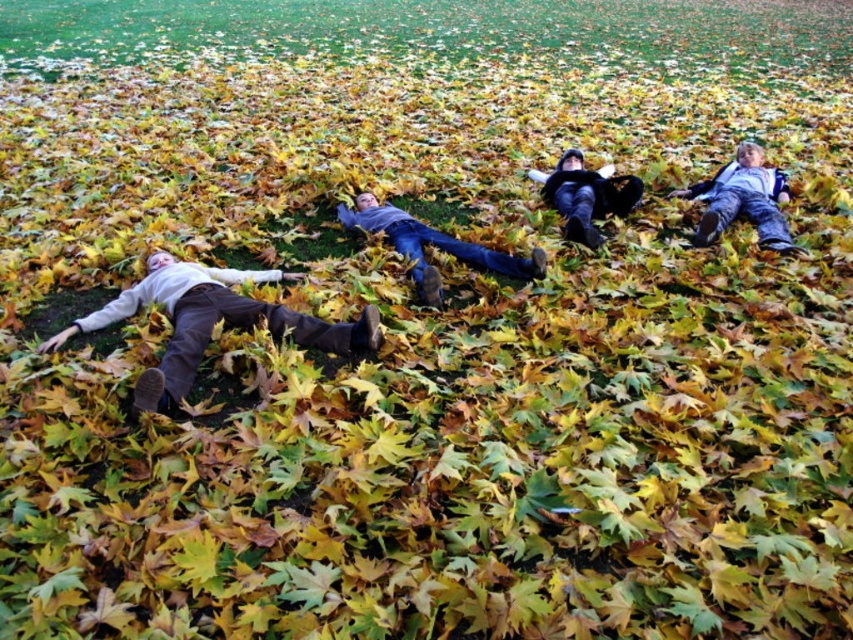
Does matte gray sweater at left appear on the left side of dark gray sweater at center?

Indeed, matte gray sweater at left is positioned on the left side of dark gray sweater at center.

Can you confirm if matte gray sweater at left is thinner than dark gray sweater at center?

No, matte gray sweater at left is not thinner than dark gray sweater at center.

Which is behind, point (161, 296) or point (625, 202)?

The point (625, 202) is more distant.

Identify the location of matte gray sweater at left. Image resolution: width=853 pixels, height=640 pixels. (212, 323).

Measure the distance from gray sweater at center to dark gray sweater at center.

gray sweater at center is 1.23 meters away from dark gray sweater at center.

Who is shorter, gray sweater at center or dark gray sweater at center?

gray sweater at center

Which is behind, point (473, 250) or point (635, 186)?

Point (635, 186)

You are a GUI agent. You are given a task and a screenshot of the screen. Output one action in this format:
    pyautogui.click(x=<x>, y=<y>)
    Task: Click on the gray sweater at center
    The width and height of the screenshot is (853, 640).
    Given the screenshot: What is the action you would take?
    tap(433, 244)

Find the location of a particular element. This screenshot has height=640, width=853. green grass at upper center is located at coordinates (432, 29).

Does green grass at upper center appear on the left side of matte gray sweater at left?

In fact, green grass at upper center is to the right of matte gray sweater at left.

Which is in front, point (799, 33) or point (152, 378)?

Point (152, 378) is more forward.

Identify the location of green grass at upper center. This screenshot has height=640, width=853. (432, 29).